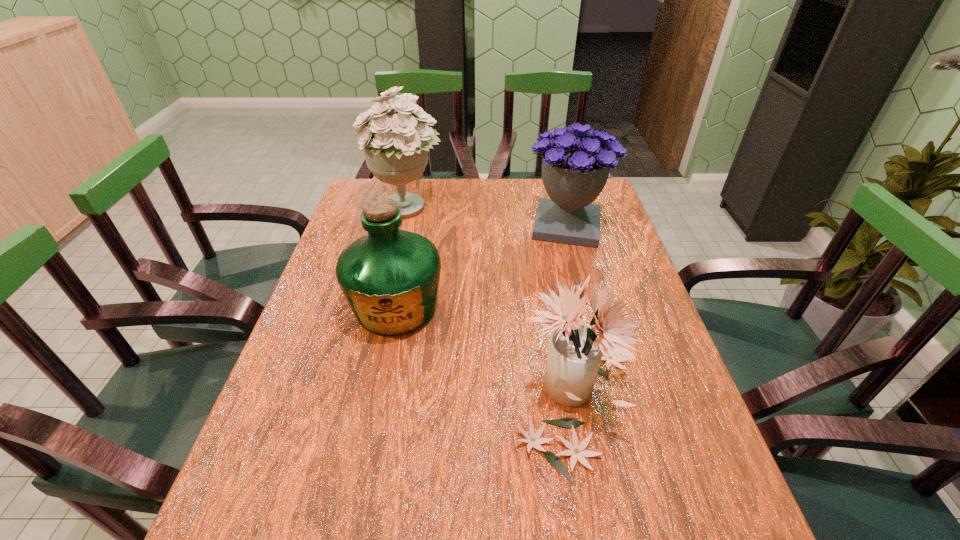
Find the location of a particular element. the tallest object is located at coordinates (395, 145).

I want to click on the tallest bouquet, so click(395, 145).

Image resolution: width=960 pixels, height=540 pixels. Find the location of `liquor`. liquor is located at coordinates (390, 277).

Image resolution: width=960 pixels, height=540 pixels. In order to click on the nearest bouquet in this screenshot , I will do `click(575, 351)`.

Locate an element on the screen. vacant region located on the right of the tallest bouquet is located at coordinates (472, 207).

At what (x,y) coordinates should I click in order to perform the action: click on vacant space located 0.390m on the label side of the liquor. Please return your answer as a coordinate pair (x, y). The height and width of the screenshot is (540, 960). Looking at the image, I should click on (352, 523).

I want to click on vacant region located 0.290m on the left of the nearest bouquet, so click(x=372, y=399).

In order to click on bouquet present at the left edge in this screenshot , I will do `click(395, 145)`.

At what (x,y) coordinates should I click in order to perform the action: click on liquor that is positioned at the left edge. Please return your answer as a coordinate pair (x, y). The image size is (960, 540). Looking at the image, I should click on (390, 277).

I want to click on object that is at the far left corner, so coord(395,145).